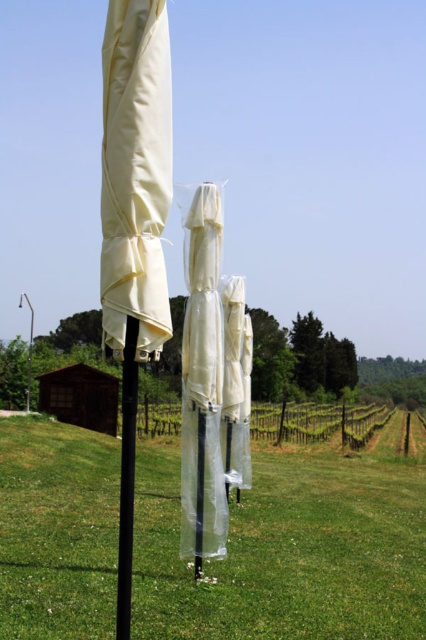
Question: From the image, what is the correct spatial relationship of black matte pole at center in relation to white plastic pole at center?

Choices:
 (A) left
 (B) right

Answer: (A)

Question: Which point is closer to the camera?

Choices:
 (A) (123, 632)
 (B) (196, 499)
 (C) (385, 563)

Answer: (A)

Question: Does black matte pole at center appear under white plastic pole at center?

Choices:
 (A) no
 (B) yes

Answer: (A)

Question: Among these points, which one is nearest to the camera?

Choices:
 (A) (123, 483)
 (B) (198, 486)
 (C) (310, 568)

Answer: (A)

Question: Which point is closer to the camera?

Choices:
 (A) green grass at center
 (B) white plastic pole at center

Answer: (A)

Question: Is black matte pole at center smaller than white plastic pole at center?

Choices:
 (A) no
 (B) yes

Answer: (A)